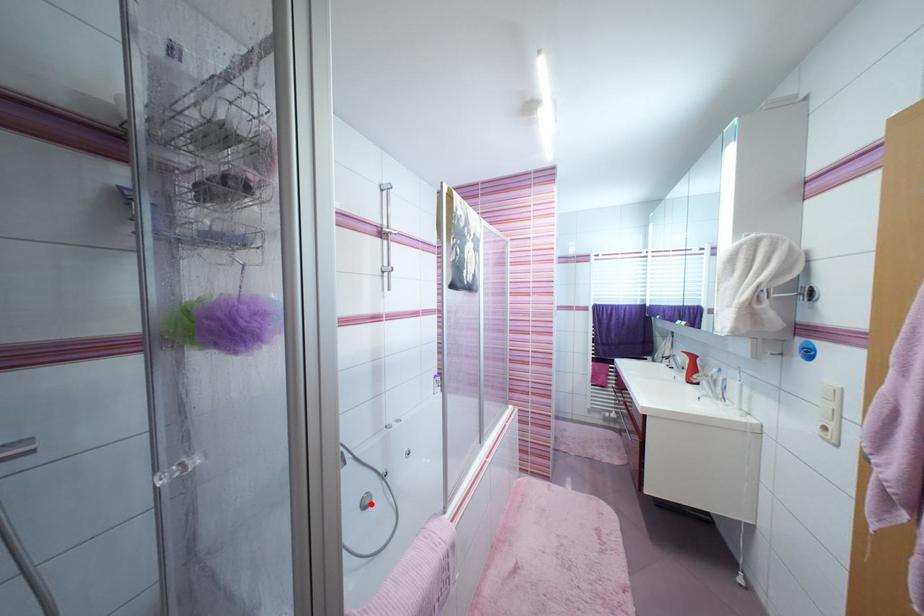
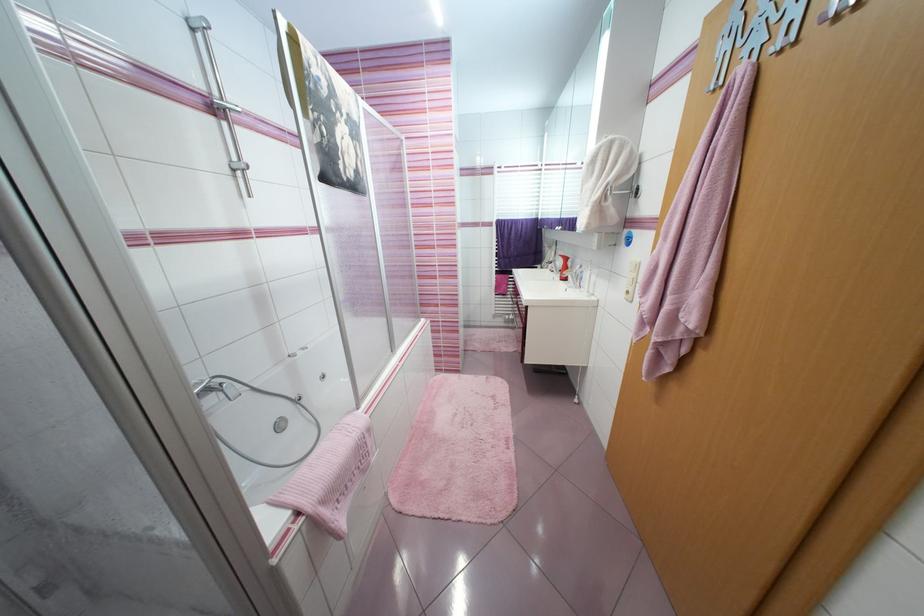
Question: I am providing you with two images of the same scene from different viewpoints. A red point is shown in image1. For the corresponding object point in image2, is it positioned nearer or farther from the camera?

Choices:
 (A) Nearer
 (B) Farther

Answer: (A)